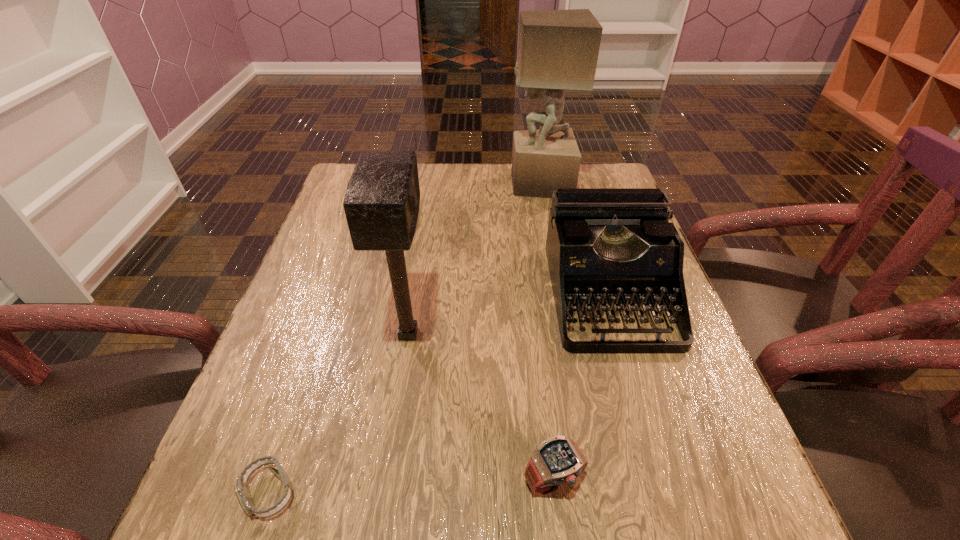
Where is `object present at the far right corner`? object present at the far right corner is located at coordinates (558, 50).

Locate an element on the screen. The image size is (960, 540). blank space at the far edge of the desktop is located at coordinates (504, 180).

Locate an element on the screen. The width and height of the screenshot is (960, 540). vacant region at the near edge of the desktop is located at coordinates (612, 527).

Image resolution: width=960 pixels, height=540 pixels. Identify the location of vacant region at the left edge of the desktop. (306, 298).

The height and width of the screenshot is (540, 960). In the image, there is a desktop. What are the coordinates of `free space at the right edge` in the screenshot? It's located at (639, 338).

In the image, there is a desktop. Find the location of `vacant space at the far right corner`. vacant space at the far right corner is located at coordinates (605, 168).

At what (x,y) coordinates should I click in order to perform the action: click on free spot at the near right corner of the desktop. Please return your answer as a coordinate pair (x, y). Looking at the image, I should click on (741, 520).

Find the location of `free space that is in between the right watch and the mallet`. free space that is in between the right watch and the mallet is located at coordinates (481, 407).

Locate an element on the screen. This screenshot has height=540, width=960. empty space that is in between the typewriter and the shorter watch is located at coordinates (439, 393).

This screenshot has height=540, width=960. In order to click on unoccupied area between the shortest object and the second tallest object in this screenshot , I will do `click(339, 414)`.